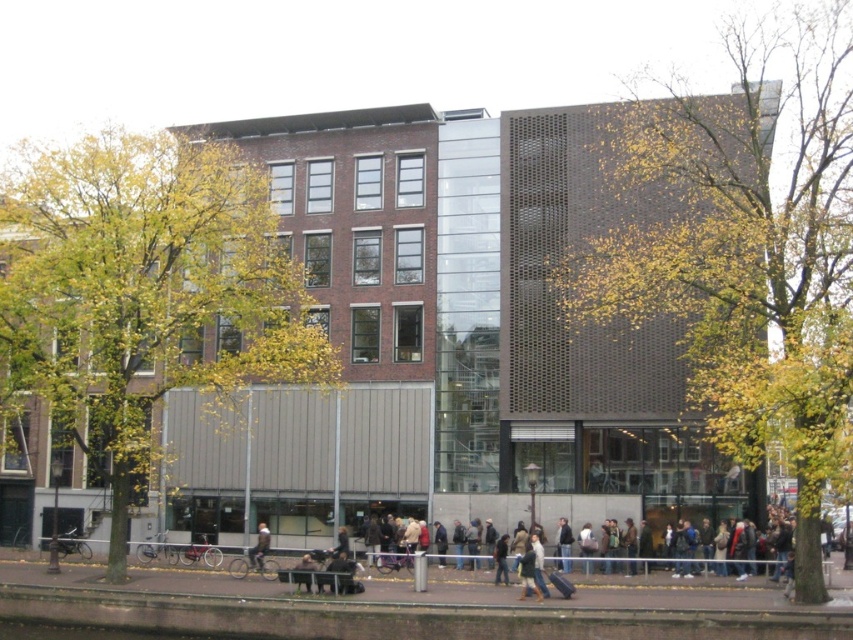
You are standing on the sidewalk in front of the building and see the green leafy tree at center and the dark blue jacket at center. Which object is positioned to the left when viewed from your perspective?

The green leafy tree at center is to the left of the dark blue jacket at center from the observer perspective.

You are standing on the sidewalk in front of the building and want to walk towards the two points marked on the building. Which point, point [556,545] or point [263,541], will you reach first?

You will reach point [556,545] first because it is closer to the viewer than point [263,541].